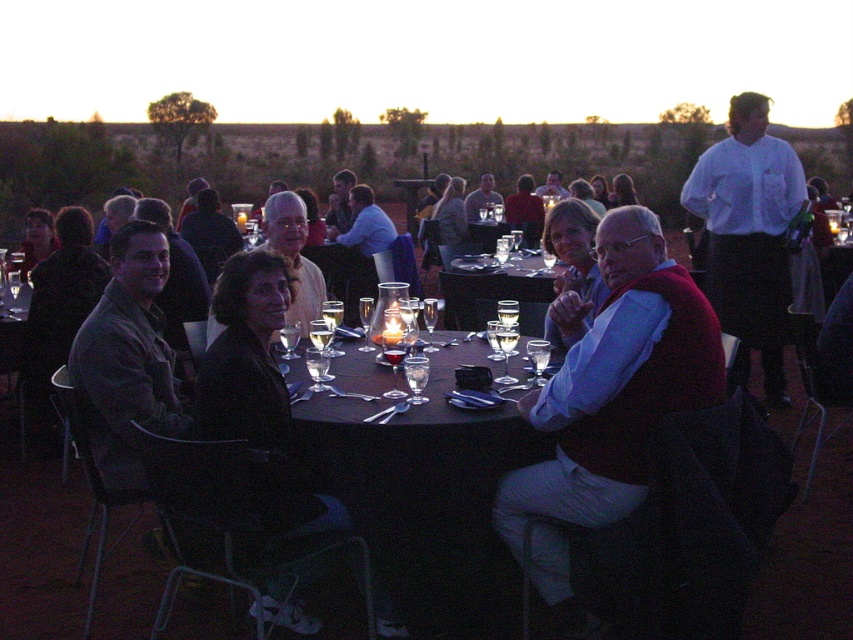
You are a photographer positioned at the edge of the table. You want to capture a photo that includes both the matte red vest at center and the white shirt at upper right without any obstructions. Given that your camera has a maximum focus range of 2 meters, will you be able to capture both subjects in focus?

The matte red vest at center is 2.12 meters away from the white shirt at upper right. Since the distance between them exceeds the camera maximum focus range of 2 meters, you will not be able to capture both subjects in focus.

You are at the dining table and want to locate the matte red vest at center. Where exactly should you look?

You should look at point 0.628 on the x axis and 0.715 on the y axis to find the matte red vest at center.

You are standing at the edge of the table in the outdoor dining scene. You see two points marked on the table surface. The first point is at coordinate point(531, 509) and the second is at point(714, 166). Which point is closer to you?

Point(531, 509) is closer to the camera than point(714, 166). Since you are standing at the edge of the table, the point closer to the camera would also be closer to you.